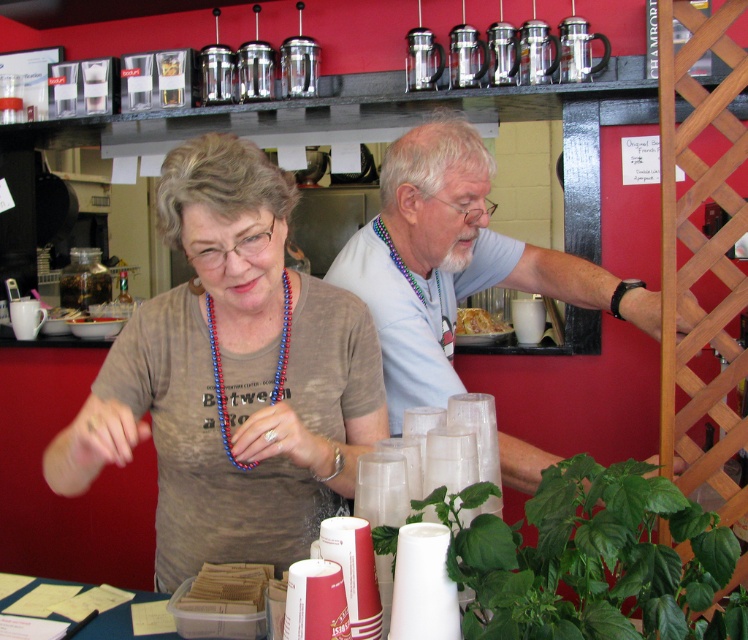
Does green leafy plant at center appear on the left side of light blue t-shirt at center?

Yes, green leafy plant at center is to the left of light blue t-shirt at center.

Describe the element at coordinates (591, 560) in the screenshot. This screenshot has height=640, width=748. I see `green leafy plant at center` at that location.

Where is `green leafy plant at center`? This screenshot has width=748, height=640. green leafy plant at center is located at coordinates (591, 560).

Which is below, brown cotton shirt at center or blue beaded necklace at center?

brown cotton shirt at center is below.

Identify the location of brown cotton shirt at center. (236, 273).

Who is more distant from viewer, (191, 243) or (218, 420)?

Positioned behind is point (218, 420).

Where is `brown cotton shirt at center`? The height and width of the screenshot is (640, 748). brown cotton shirt at center is located at coordinates (236, 273).

Which of these two, green leafy plant at center or brown cotton shirt at center, stands taller?

brown cotton shirt at center is taller.

Which is behind, point (702, 577) or point (245, 225)?

Point (245, 225)

Who is more forward, (576, 460) or (205, 262)?

Point (576, 460) is more forward.

Locate an element on the screen. Image resolution: width=748 pixels, height=640 pixels. green leafy plant at center is located at coordinates (591, 560).